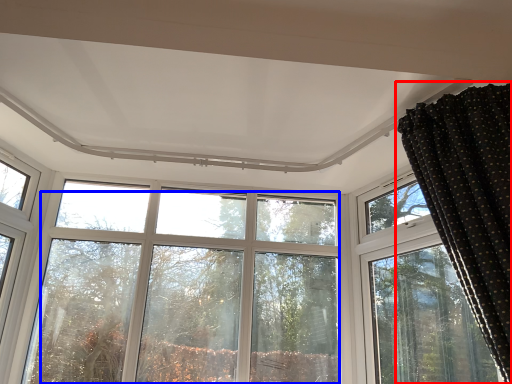
Question: Among these objects, which one is nearest to the camera, curtain (highlighted by a red box) or tree (highlighted by a blue box)?

Choices:
 (A) curtain
 (B) tree

Answer: (A)